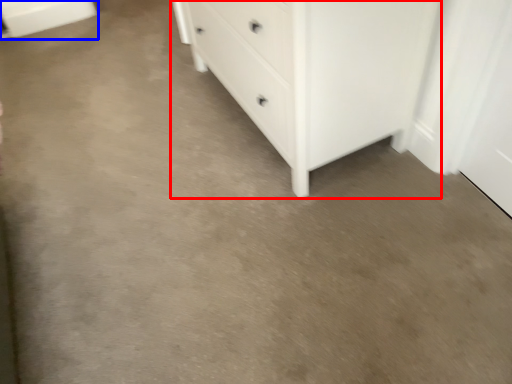
Question: Which object appears farthest to the camera in this image, chest of drawers (highlighted by a red box) or cabinetry (highlighted by a blue box)?

Choices:
 (A) chest of drawers
 (B) cabinetry

Answer: (B)